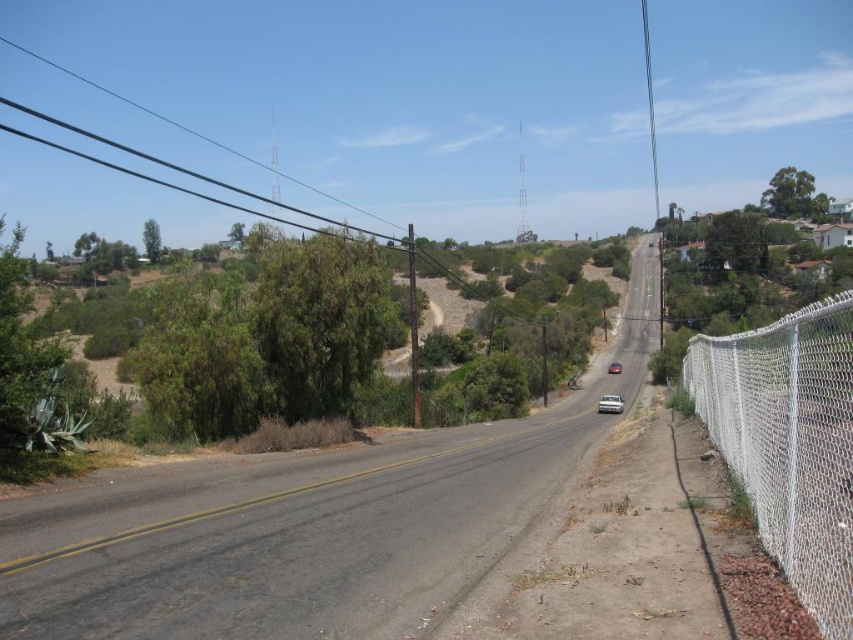
You are standing at the origin point of the image. A drone is flying towards the asphalt road at center. What are the coordinates where the drone will land?

The drone will land at the coordinates point (305, 525) where the asphalt road at center is located.